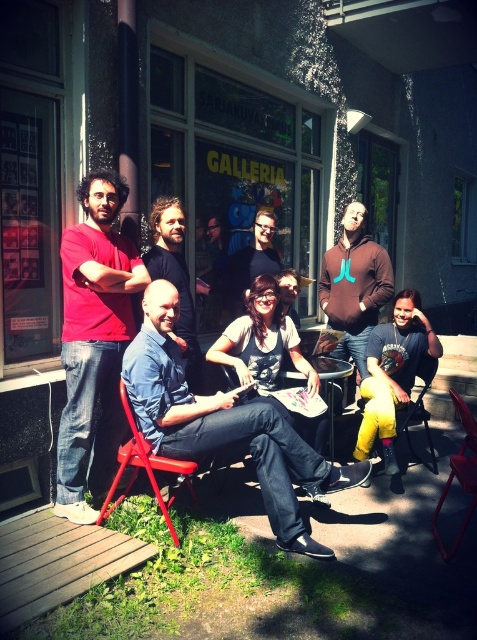
Consider the image. You are a photographer setting up for a group photo. You notice the denim shirt at center and the yellow fabric chair at lower right. Which object is covering the other?

The denim shirt at center is positioned over yellow fabric chair at lower right, so the denim shirt is covering the yellow fabric chair.

You are standing at the center of the wooden deck and want to find the point at coordinates (224,424). Which object is this point located on?

The point at coordinates (224,424) is located on the denim shirt at center.

You are a photographer trying to capture a closeup of the matte red shirt at left without including the yellow fabric chair at lower right in the frame. Based on their positions, is this possible?

The matte red shirt at left is located above the yellow fabric chair at lower right, so it is possible to capture a closeup of the matte red shirt at left without including the yellow fabric chair at lower right by adjusting the camera angle to focus on the upper area where the shirt is positioned.